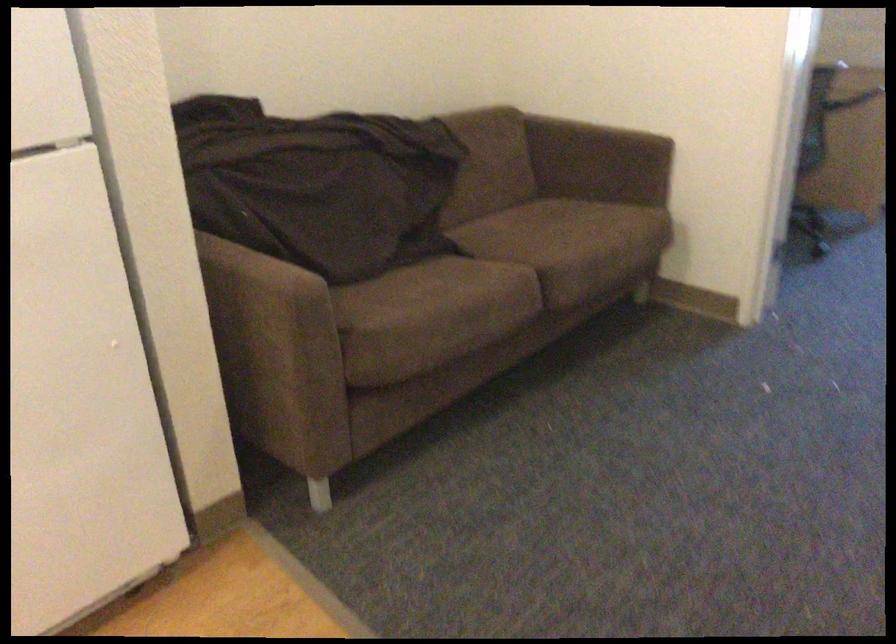
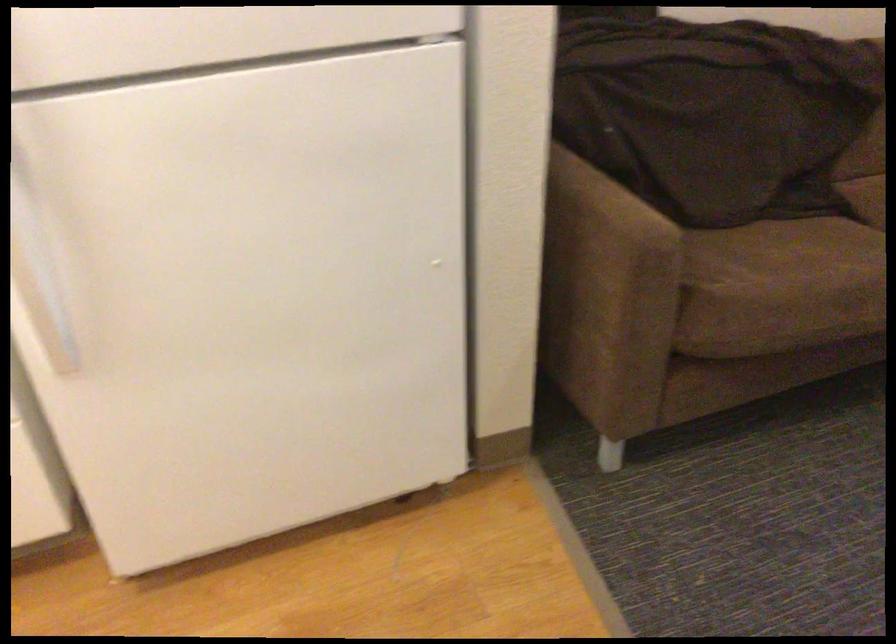
Based on the photo, the images are taken continuously from a first-person perspective. In which direction are you moving?

The cameraman walked toward left, forward.